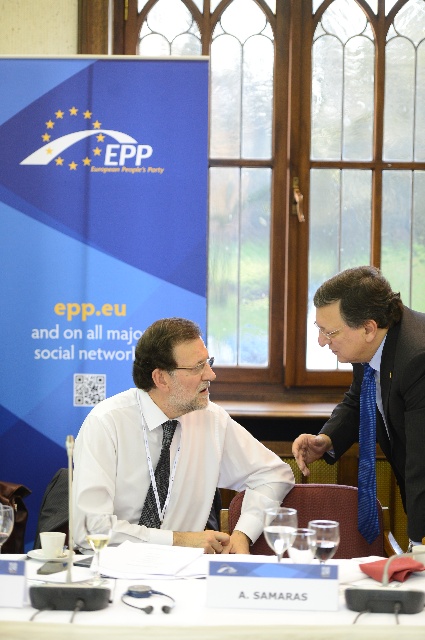
Based on the photo, can you confirm if white paper at center is bigger than blue silk suit at center?

No.

How far apart are white paper at center and blue silk suit at center?

They are 28.97 inches apart.

What are the coordinates of `white paper at center` in the screenshot? It's located at (210, 618).

Is point (204, 634) behind point (299, 435)?

That is False.

At what (x,y) coordinates should I click in order to perform the action: click on white paper at center. Please return your answer as a coordinate pair (x, y). Looking at the image, I should click on (210, 618).

Image resolution: width=425 pixels, height=640 pixels. In order to click on white paper at center in this screenshot , I will do `click(210, 618)`.

Between blue textured tie at right and smooth skin hand at center, which one is positioned higher?

blue textured tie at right is higher up.

This screenshot has width=425, height=640. Describe the element at coordinates (367, 458) in the screenshot. I see `blue textured tie at right` at that location.

The width and height of the screenshot is (425, 640). What are the coordinates of `blue textured tie at right` in the screenshot? It's located at (367, 458).